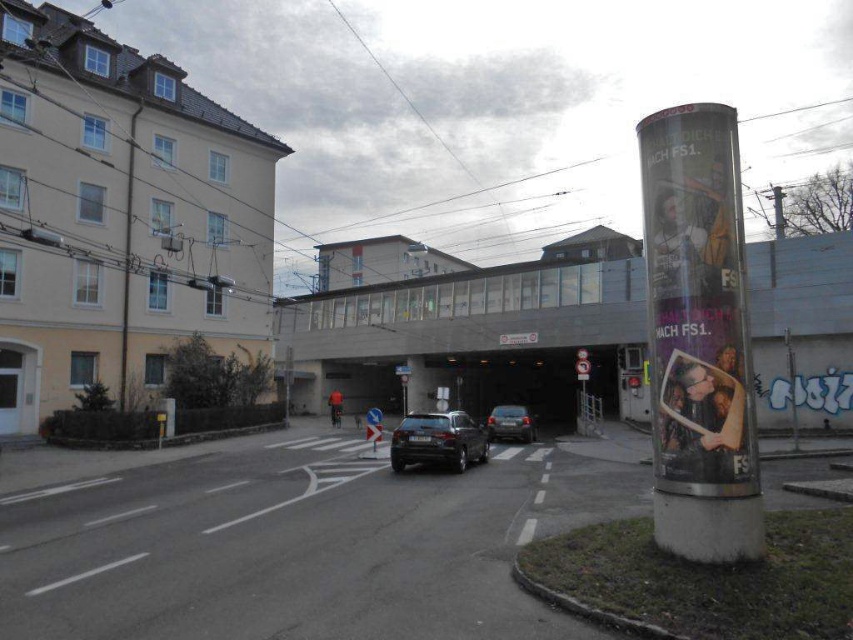
You are a delivery driver trying to park your truck in a tight spot. You see a satin black suv at center and a shiny silver sedan at center. Which vehicle should you avoid parking next to to ensure enough space?

→ You should avoid parking next to the shiny silver sedan at center because it occupies more space than the satin black suv at center.

You are a delivery driver who needs to secure a package using a metallic wire. There is a metallic wire at left and a shiny silver sedan at center in your view. Which object is positioned to the left of the other?

The metallic wire at left is to the left of the shiny silver sedan at center.